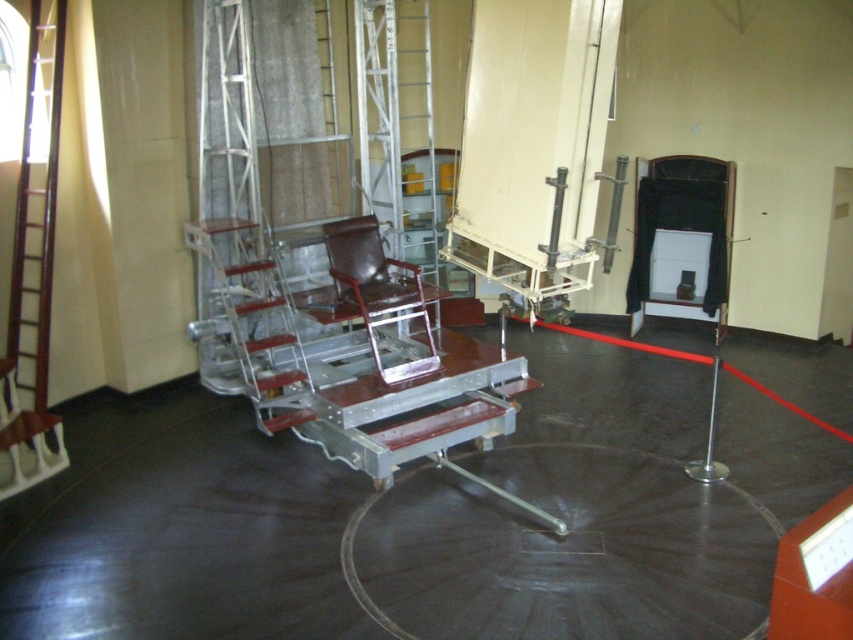
Question: Which point is closer to the camera?

Choices:
 (A) (358, 257)
 (B) (219, 256)

Answer: (A)

Question: Among these objects, which one is nearest to the camera?

Choices:
 (A) leather-like brown chair at center
 (B) metallic silver ladder at left
 (C) wooden ladder at left

Answer: (C)

Question: Among these objects, which one is nearest to the camera?

Choices:
 (A) wooden ladder at left
 (B) leather-like brown chair at center
 (C) metallic silver ladder at left

Answer: (A)

Question: Does metallic silver ladder at left appear on the right side of leather-like brown chair at center?

Choices:
 (A) no
 (B) yes

Answer: (A)

Question: Does metallic silver ladder at left appear over leather-like brown chair at center?

Choices:
 (A) yes
 (B) no

Answer: (A)

Question: Is metallic silver ladder at left bigger than leather-like brown chair at center?

Choices:
 (A) yes
 (B) no

Answer: (A)